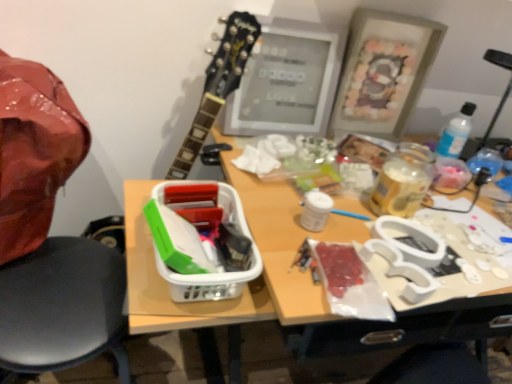
Question: Does black plastic chair at left have a lesser height compared to matte gray frame at upper center?

Choices:
 (A) yes
 (B) no

Answer: (B)

Question: Is matte gray frame at upper center surrounded by black plastic chair at left?

Choices:
 (A) no
 (B) yes

Answer: (A)

Question: From the image's perspective, is black plastic chair at left located above matte gray frame at upper center?

Choices:
 (A) no
 (B) yes

Answer: (A)

Question: Is black plastic chair at left wider than matte gray frame at upper center?

Choices:
 (A) yes
 (B) no

Answer: (A)

Question: From the image's perspective, is black plastic chair at left beneath matte gray frame at upper center?

Choices:
 (A) no
 (B) yes

Answer: (B)

Question: Is wooden picture frame at upper right inside the boundaries of matte gray frame at upper center, or outside?

Choices:
 (A) inside
 (B) outside

Answer: (B)

Question: From a real-world perspective, is wooden picture frame at upper right physically located above or below matte gray frame at upper center?

Choices:
 (A) below
 (B) above

Answer: (B)

Question: Relative to matte gray frame at upper center, is wooden picture frame at upper right in front or behind?

Choices:
 (A) front
 (B) behind

Answer: (B)

Question: Is wooden picture frame at upper right to the left or to the right of matte gray frame at upper center in the image?

Choices:
 (A) right
 (B) left

Answer: (A)

Question: Considering the positions of wooden picture frame at upper right and white plastic lunch box at center in the image, is wooden picture frame at upper right wider or thinner than white plastic lunch box at center?

Choices:
 (A) wide
 (B) thin

Answer: (B)

Question: In terms of height, does wooden picture frame at upper right look taller or shorter compared to white plastic lunch box at center?

Choices:
 (A) tall
 (B) short

Answer: (A)

Question: From a real-world perspective, is wooden picture frame at upper right above or below white plastic lunch box at center?

Choices:
 (A) above
 (B) below

Answer: (A)

Question: Considering the positions of wooden picture frame at upper right and white plastic lunch box at center in the image, is wooden picture frame at upper right bigger or smaller than white plastic lunch box at center?

Choices:
 (A) small
 (B) big

Answer: (B)

Question: Considering the positions of matte gray frame at upper center and black plastic chair at left in the image, is matte gray frame at upper center bigger or smaller than black plastic chair at left?

Choices:
 (A) big
 (B) small

Answer: (B)

Question: From a real-world perspective, is matte gray frame at upper center above or below black plastic chair at left?

Choices:
 (A) above
 (B) below

Answer: (A)